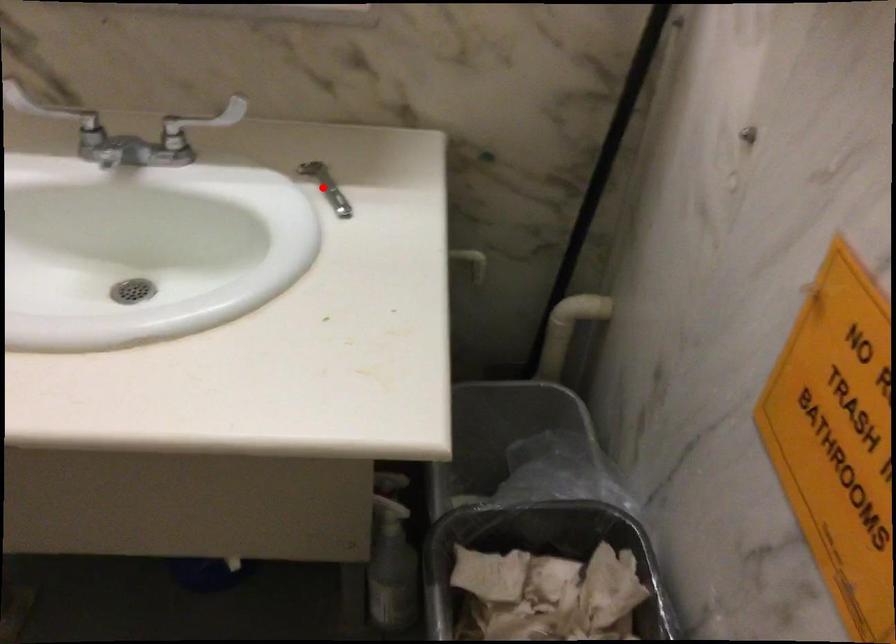
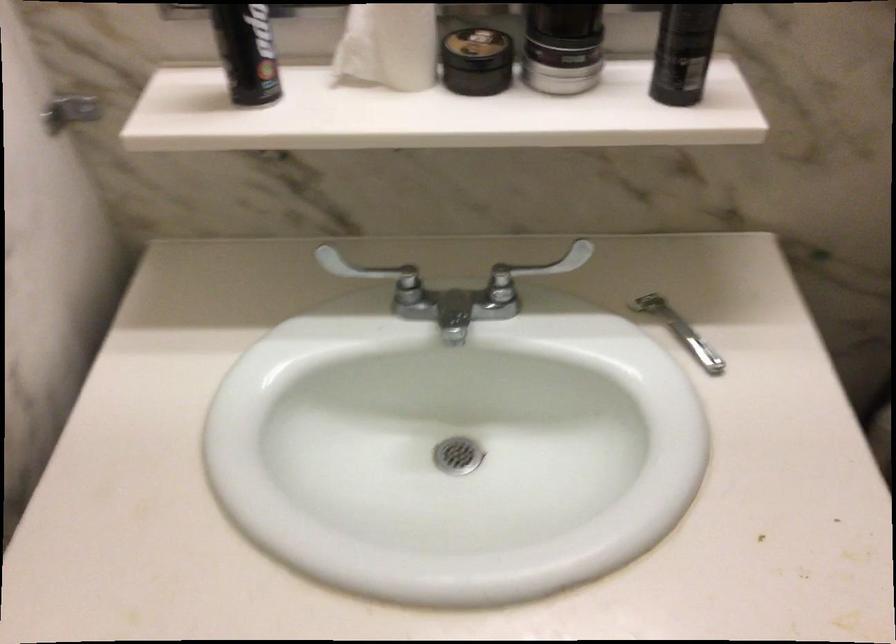
Find the pixel in the second image that matches the highlighted location in the first image.

(679, 330)